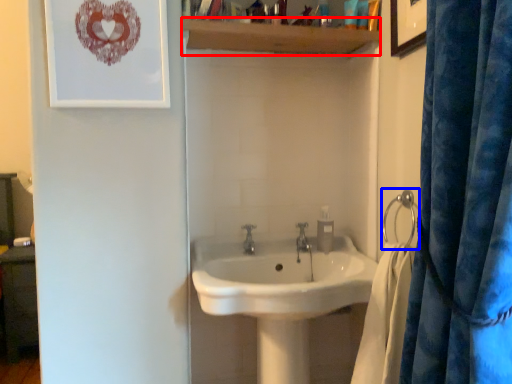
Question: Which object is closer to the camera taking this photo, balustrade (highlighted by a red box) or shower (highlighted by a blue box)?

Choices:
 (A) balustrade
 (B) shower

Answer: (B)